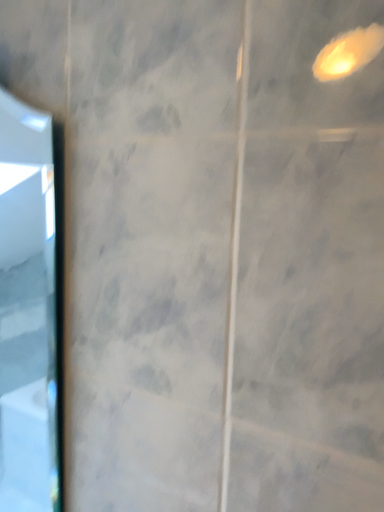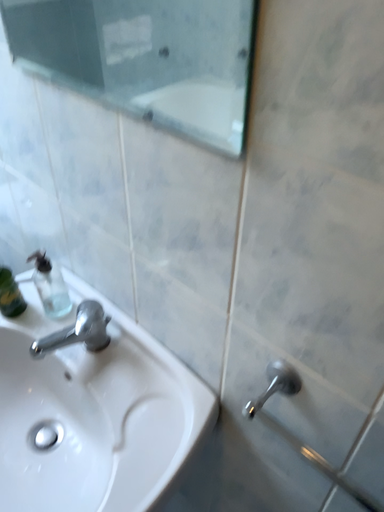
Question: Which way did the camera rotate in the video?

Choices:
 (A) rotated upward
 (B) rotated downward

Answer: (B)